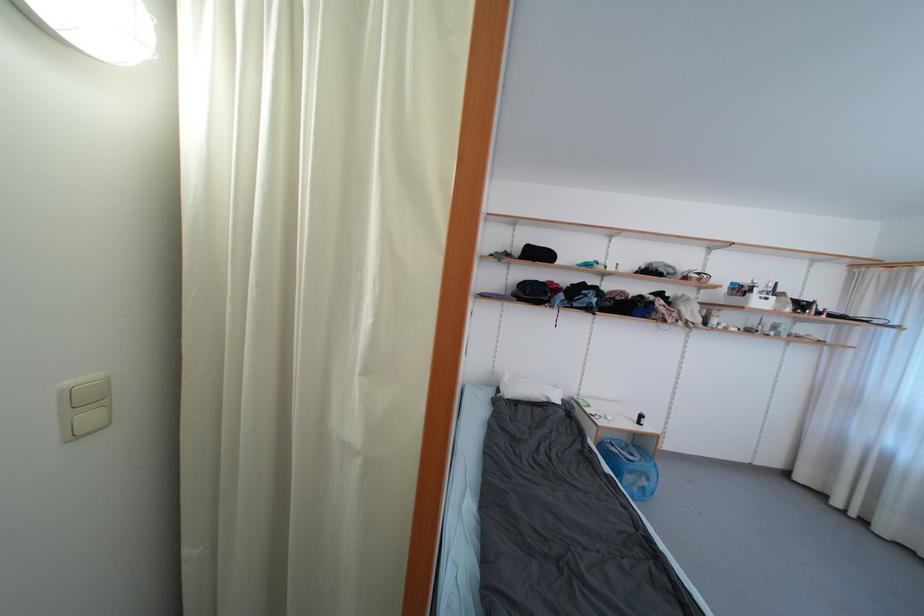
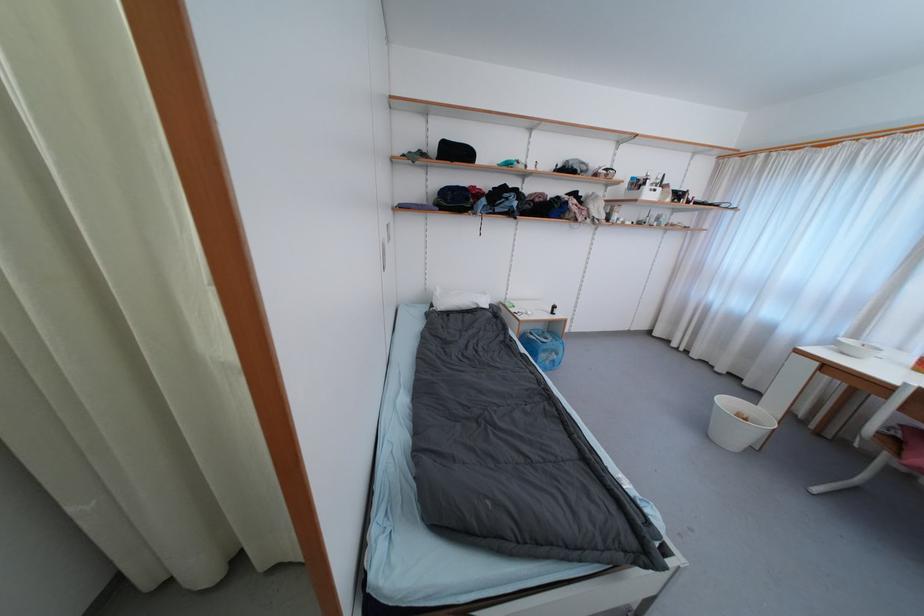
Find the pixel in the second image that matches pixel 648 424 in the first image.

(560, 313)